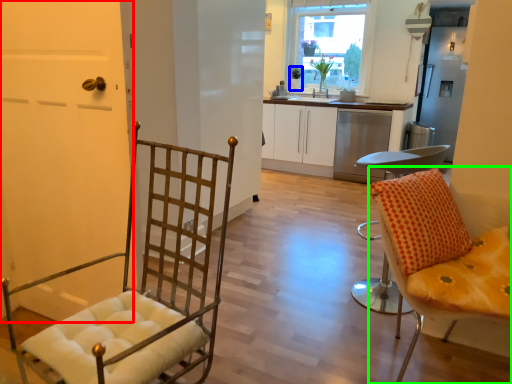
Question: Based on their relative distances, which object is farther from door (highlighted by a red box)? Choose from houseplant (highlighted by a blue box) and chair (highlighted by a green box).

Choices:
 (A) houseplant
 (B) chair

Answer: (A)